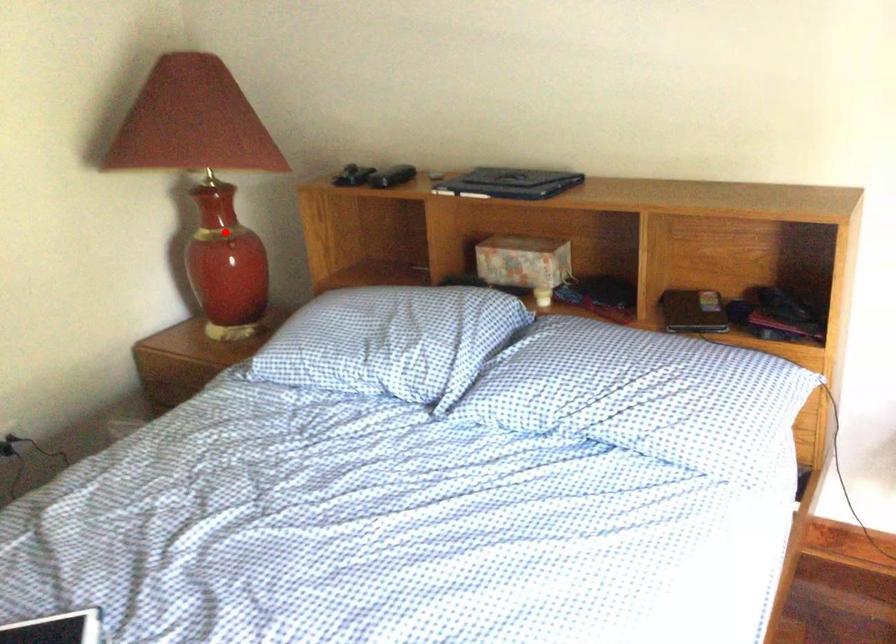
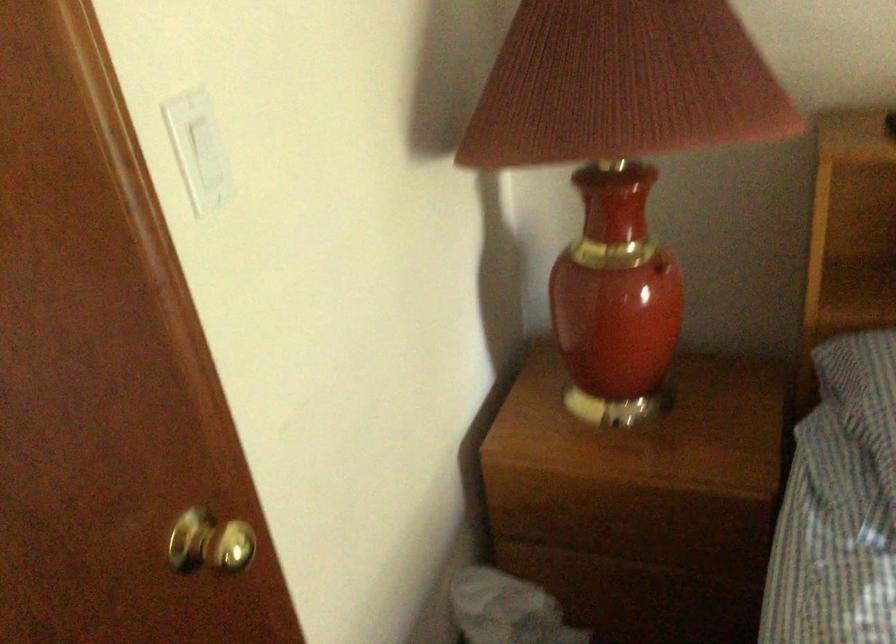
Find the pixel in the second image that matches the highlighted location in the first image.

(661, 267)